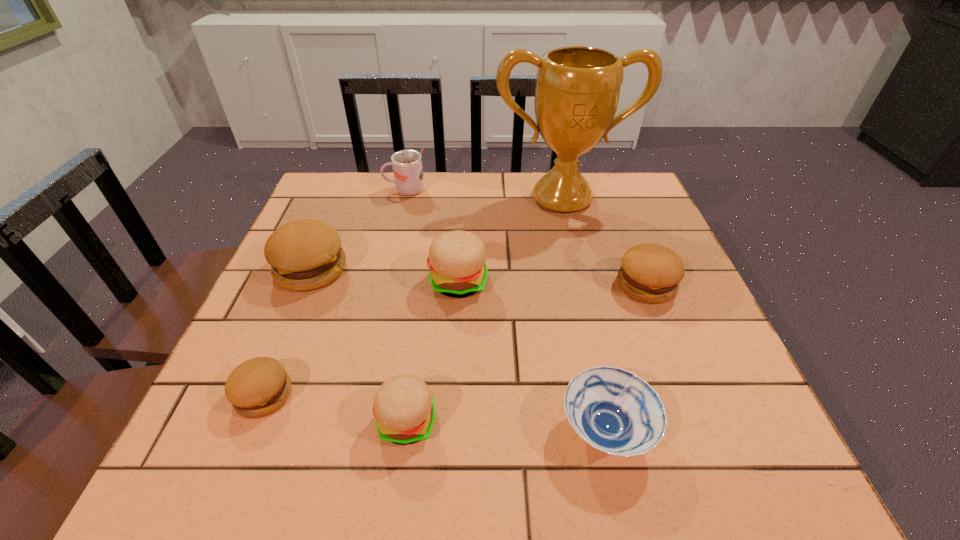
What are the coordinates of `award` in the screenshot? It's located at (577, 91).

In order to click on cup in this screenshot , I will do `click(407, 164)`.

This screenshot has width=960, height=540. What are the coordinates of `the farther beige hamburger` in the screenshot? It's located at (456, 260).

Identify the location of the biggest brown hamburger. The width and height of the screenshot is (960, 540). (306, 254).

Where is `the second smallest brown hamburger`? The image size is (960, 540). the second smallest brown hamburger is located at coordinates (650, 273).

Find the location of a particular element. This screenshot has width=960, height=540. the rightmost brown hamburger is located at coordinates (650, 273).

Where is `the smaller beige hamburger`? This screenshot has width=960, height=540. the smaller beige hamburger is located at coordinates [404, 409].

Locate an element on the screen. The height and width of the screenshot is (540, 960). blue soup bowl is located at coordinates [x=615, y=411].

Identify the location of the nearest brown hamburger. (258, 387).

This screenshot has height=540, width=960. Find the location of `the smallest brown hamburger`. the smallest brown hamburger is located at coordinates (258, 387).